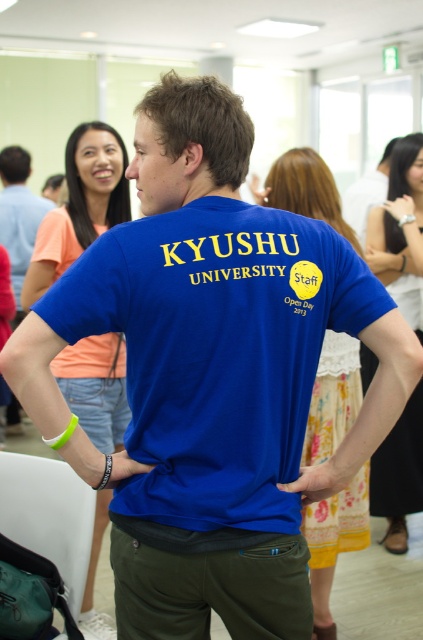
Question: Which object is positioned closest to the orange t-shirt at upper left?

Choices:
 (A) floral cotton dress at center
 (B) blue cotton t-shirt at center

Answer: (A)

Question: Which object is the farthest from the floral cotton dress at center?

Choices:
 (A) orange t-shirt at upper left
 (B) blue cotton t-shirt at center
 (C) light blue shirt at left

Answer: (C)

Question: Does floral cotton dress at center have a greater width compared to blue fabric dress at right?

Choices:
 (A) no
 (B) yes

Answer: (A)

Question: Is blue cotton t-shirt at center closer to camera compared to light blue shirt at left?

Choices:
 (A) yes
 (B) no

Answer: (A)

Question: Which point is farther from the camera taking this photo?

Choices:
 (A) (398, 428)
 (B) (132, 360)

Answer: (A)

Question: Is blue cotton t-shirt at center to the left of light blue shirt at left from the viewer's perspective?

Choices:
 (A) yes
 (B) no

Answer: (B)